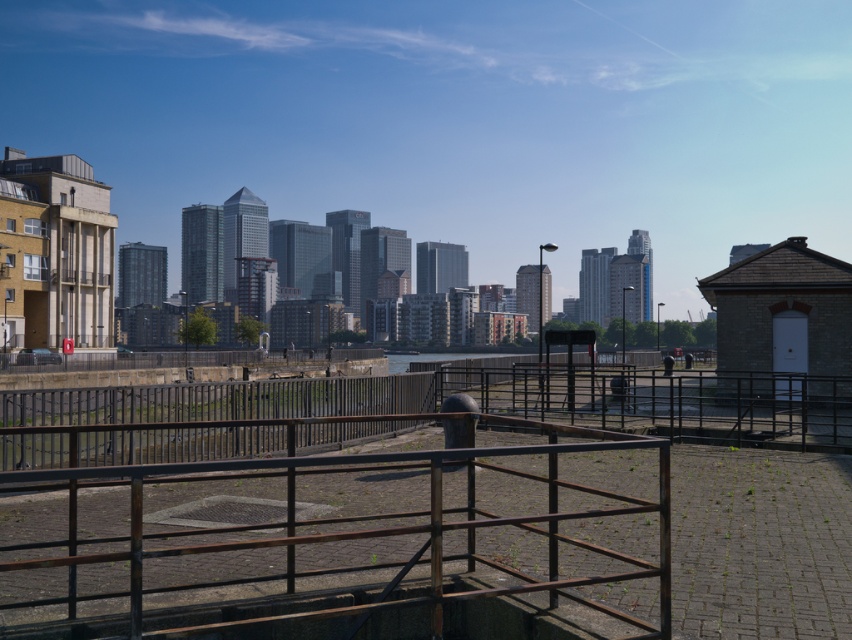
You are a city planner evaluating the safety of the waterfront walkway. You notice the rusty metal rail at center and the rusty metal fence at center. Which of these two structures is more likely to require immediate repair due to its smaller size and potential instability?

The rusty metal rail at center is smaller than the rusty metal fence at center, making it more likely to require immediate repair due to its potential instability.

From the picture: You are a maintenance worker assigned to inspect the rusty metal rail at center and the rusty metal fence at center. According to the scene, which one is positioned higher relative to the other?

The rusty metal rail at center is located above the rusty metal fence at center, so it is positioned higher.

You are standing at point 0.5, 0.5 in the image. You want to walk towards the modern building with columns on the left side. Which direction should you move relative to the rusty metal rail at center located at point (329, 536)?

Since the rusty metal rail at center is located at point (329, 536), which is to the right and slightly above your current position at 0.5, 0.5, you should move to the left and slightly downward to reach the modern building with columns on the left side.